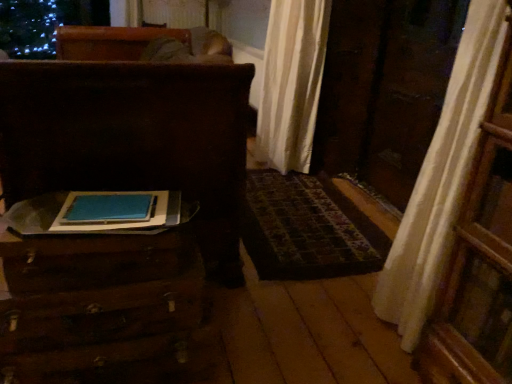
Question: From a real-world perspective, is wooden trunk at left, acting as the 1th furniture starting from the top, physically below wooden suitcase at lower left, which is the second furniture from top to bottom?

Choices:
 (A) no
 (B) yes

Answer: (A)

Question: Is wooden trunk at left, which is the second furniture in bottom-to-top order, positioned with its back to wooden suitcase at lower left, which is the second furniture from top to bottom?

Choices:
 (A) yes
 (B) no

Answer: (B)

Question: Does wooden trunk at left, acting as the 1th furniture starting from the top, lie behind wooden suitcase at lower left, which is the second furniture from top to bottom?

Choices:
 (A) no
 (B) yes

Answer: (B)

Question: Is wooden trunk at left, which is the second furniture in bottom-to-top order, not close to wooden suitcase at lower left, acting as the 1th furniture starting from the bottom?

Choices:
 (A) yes
 (B) no

Answer: (B)

Question: From a real-world perspective, does wooden trunk at left, which is the second furniture in bottom-to-top order, stand above wooden suitcase at lower left, which is the second furniture from top to bottom?

Choices:
 (A) no
 (B) yes

Answer: (B)

Question: Considering the relative positions of wooden trunk at left, which is the second furniture in bottom-to-top order, and wooden suitcase at lower left, which is the second furniture from top to bottom, in the image provided, is wooden trunk at left, which is the second furniture in bottom-to-top order, to the right of wooden suitcase at lower left, which is the second furniture from top to bottom, from the viewer's perspective?

Choices:
 (A) no
 (B) yes

Answer: (A)

Question: Is wooden suitcase at lower left, acting as the 1th furniture starting from the bottom, far away from wooden trunk at left, acting as the 1th furniture starting from the top?

Choices:
 (A) yes
 (B) no

Answer: (B)

Question: Is wooden suitcase at lower left, acting as the 1th furniture starting from the bottom, looking in the opposite direction of wooden trunk at left, which is the second furniture in bottom-to-top order?

Choices:
 (A) no
 (B) yes

Answer: (A)

Question: Can you confirm if wooden suitcase at lower left, acting as the 1th furniture starting from the bottom, is wider than wooden trunk at left, which is the second furniture in bottom-to-top order?

Choices:
 (A) no
 (B) yes

Answer: (A)

Question: Is wooden suitcase at lower left, acting as the 1th furniture starting from the bottom, oriented towards wooden trunk at left, which is the second furniture in bottom-to-top order?

Choices:
 (A) yes
 (B) no

Answer: (B)

Question: From a real-world perspective, is wooden suitcase at lower left, acting as the 1th furniture starting from the bottom, under wooden trunk at left, which is the second furniture in bottom-to-top order?

Choices:
 (A) yes
 (B) no

Answer: (A)

Question: Is wooden suitcase at lower left, acting as the 1th furniture starting from the bottom, touching wooden trunk at left, which is the second furniture in bottom-to-top order?

Choices:
 (A) yes
 (B) no

Answer: (B)

Question: Considering the positions of wooden suitcase at lower left, which is the second furniture from top to bottom, and wooden trunk at left, which is the second furniture in bottom-to-top order, in the image, is wooden suitcase at lower left, which is the second furniture from top to bottom, taller or shorter than wooden trunk at left, which is the second furniture in bottom-to-top order,?

Choices:
 (A) short
 (B) tall

Answer: (A)